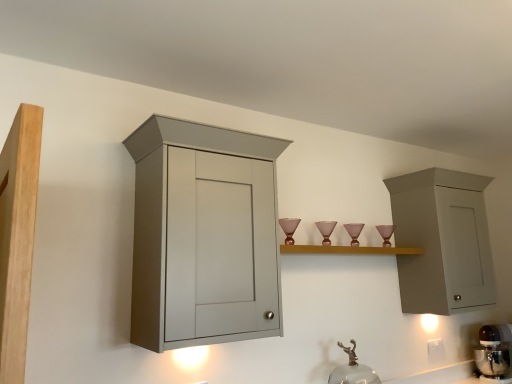
Question: Is white plastic electric outlet at lower right in front of or behind matte wood cupboard at left in the image?

Choices:
 (A) front
 (B) behind

Answer: (B)

Question: Does point (432, 342) appear closer or farther from the camera than point (22, 206)?

Choices:
 (A) farther
 (B) closer

Answer: (A)

Question: Which object is the farthest from the matte wood cupboard at left?

Choices:
 (A) light wood shelf at center
 (B) metallic silver mixer at lower right
 (C) transparent glass faucet at lower center
 (D) matte gray cabinet at left, the second cabinetry from the right
 (E) matte gray cabinet at upper right, which appears as the 1th cabinetry when viewed from the right

Answer: (B)

Question: Estimate the real-world distances between objects in this image. Which object is farther from the matte gray cabinet at left, the second cabinetry from the right?

Choices:
 (A) matte wood cupboard at left
 (B) transparent glass faucet at lower center
 (C) light wood shelf at center
 (D) white plastic electric outlet at lower right
 (E) metallic silver mixer at lower right

Answer: (E)